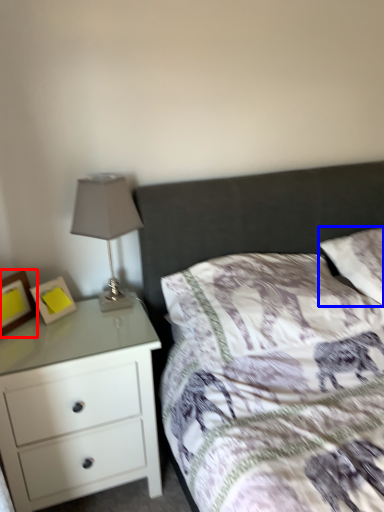
Question: Among these objects, which one is farthest to the camera, picture frame (highlighted by a red box) or pillow (highlighted by a blue box)?

Choices:
 (A) picture frame
 (B) pillow

Answer: (B)